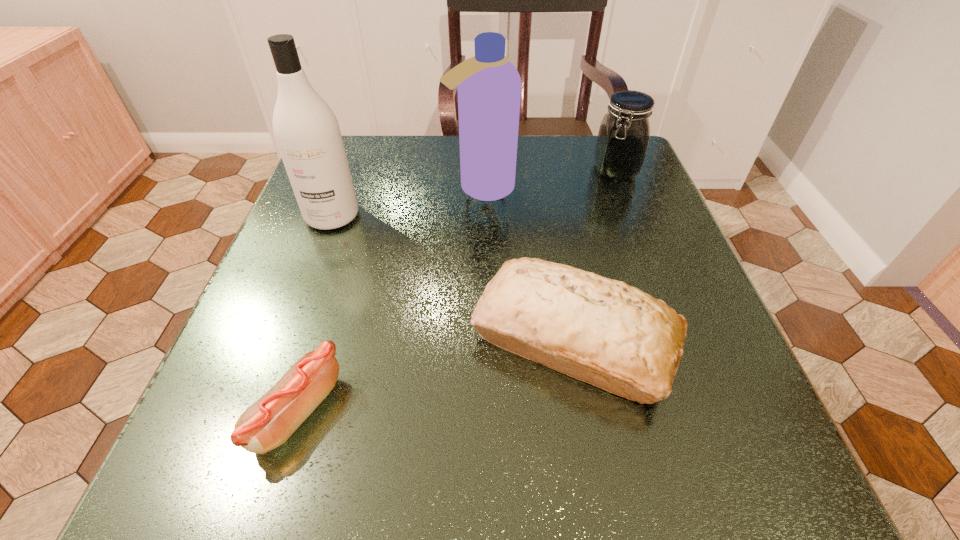
Image resolution: width=960 pixels, height=540 pixels. In the image, there is a desktop. Identify the location of vacant space at the near edge. (322, 448).

You are a GUI agent. You are given a task and a screenshot of the screen. Output one action in this format:
    pyautogui.click(x=<x>, y=<y>)
    Task: Click on the vacant region at the right edge
    This screenshot has width=960, height=540.
    Given the screenshot: What is the action you would take?
    pyautogui.click(x=769, y=423)

In the image, there is a desktop. Identify the location of vacant space at the far left corner. The height and width of the screenshot is (540, 960). (364, 191).

Identify the location of free space at the near left corner of the desktop. (304, 468).

Where is `free space between the right shampoo and the shortest object`? free space between the right shampoo and the shortest object is located at coordinates (390, 299).

Identify the location of vacant area that lies between the second shortest object and the left shampoo. This screenshot has width=960, height=540. (453, 277).

What are the coordinates of `vacant region between the bread and the third shortest object` in the screenshot? It's located at (594, 254).

Where is `free space between the third tallest object and the second shortest object`? The height and width of the screenshot is (540, 960). free space between the third tallest object and the second shortest object is located at coordinates click(x=594, y=254).

I want to click on vacant space in between the bread and the sausage, so click(x=436, y=374).

You are a GUI agent. You are given a task and a screenshot of the screen. Output one action in this format:
    pyautogui.click(x=<x>, y=<y>)
    Task: Click on the empty space between the third shortest object and the bread
    
    Given the screenshot: What is the action you would take?
    pyautogui.click(x=594, y=254)